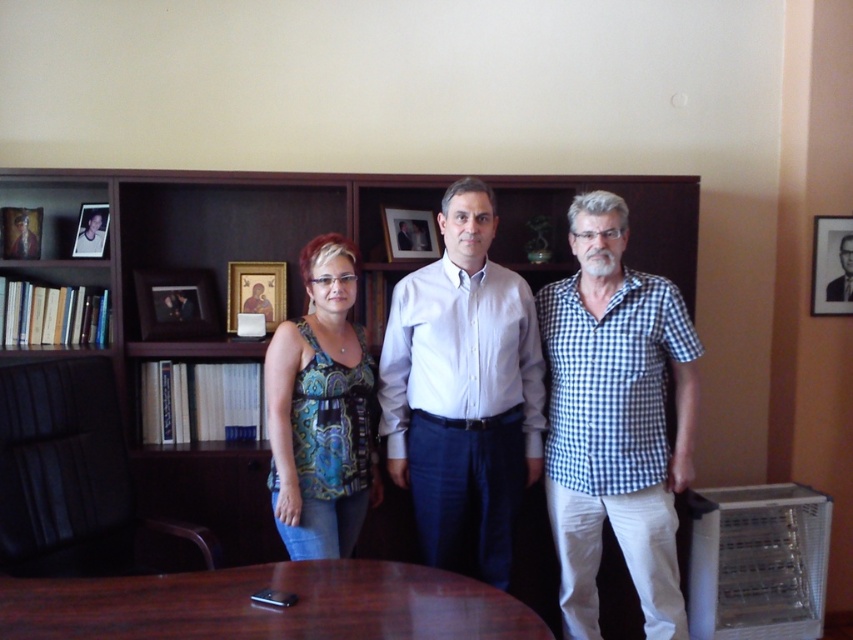
Question: Does brown wooden table at center appear on the right side of formal black suit at center?

Choices:
 (A) no
 (B) yes

Answer: (A)

Question: Which point appears farthest from the camera in this image?

Choices:
 (A) (82, 216)
 (B) (587, 250)
 (C) (821, 288)
 (D) (228, 266)

Answer: (C)

Question: Which object appears farthest from the camera in this image?

Choices:
 (A) white checkered shirt at right
 (B) white shirt at center
 (C) formal black suit at center

Answer: (C)

Question: Can you confirm if patterned fabric top at center is smaller than formal black suit at center?

Choices:
 (A) no
 (B) yes

Answer: (A)

Question: Does patterned fabric top at center lie in front of wooden framed photo at center?

Choices:
 (A) yes
 (B) no

Answer: (A)

Question: Which object appears closest to the camera in this image?

Choices:
 (A) white shirt at center
 (B) black matte picture frame at upper right
 (C) matte plastic picture frame at upper left
 (D) matte black shirt at center

Answer: (A)